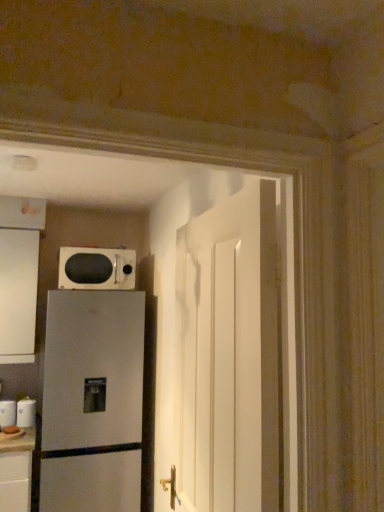
Question: From the image's perspective, is white glossy mug at lower left, which is the 1th appliance from left to right, located beneath white glossy paper towel dispenser at lower left, which is the first appliance in right-to-left order?

Choices:
 (A) no
 (B) yes

Answer: (B)

Question: Is white glossy mug at lower left, which is counted as the second appliance, starting from the right, positioned with its back to white glossy paper towel dispenser at lower left, which appears as the second appliance when viewed from the left?

Choices:
 (A) yes
 (B) no

Answer: (B)

Question: Could you tell me if white glossy mug at lower left, which is counted as the second appliance, starting from the right, is facing white glossy paper towel dispenser at lower left, which appears as the second appliance when viewed from the left?

Choices:
 (A) no
 (B) yes

Answer: (A)

Question: Is white glossy mug at lower left, which is the 1th appliance from left to right, in contact with white glossy paper towel dispenser at lower left, which is the first appliance in right-to-left order?

Choices:
 (A) yes
 (B) no

Answer: (A)

Question: From the image's perspective, would you say white glossy mug at lower left, which is counted as the second appliance, starting from the right, is positioned over white glossy paper towel dispenser at lower left, which appears as the second appliance when viewed from the left?

Choices:
 (A) no
 (B) yes

Answer: (A)

Question: From the image's perspective, is white glossy microwave at upper center positioned above or below white glossy paper towel dispenser at lower left, which is the first appliance in right-to-left order?

Choices:
 (A) below
 (B) above

Answer: (B)

Question: Is white glossy microwave at upper center wider or thinner than white glossy paper towel dispenser at lower left, which is the first appliance in right-to-left order?

Choices:
 (A) wide
 (B) thin

Answer: (A)

Question: From a real-world perspective, is white glossy microwave at upper center above or below white glossy paper towel dispenser at lower left, which appears as the second appliance when viewed from the left?

Choices:
 (A) above
 (B) below

Answer: (A)

Question: Is point (117, 259) closer or farther from the camera than point (26, 402)?

Choices:
 (A) farther
 (B) closer

Answer: (A)

Question: Does point (9, 205) appear closer or farther from the camera than point (66, 485)?

Choices:
 (A) closer
 (B) farther

Answer: (B)

Question: From the image's perspective, is white matte cabinet at left located above or below satin silver refrigerator at lower left?

Choices:
 (A) below
 (B) above

Answer: (B)

Question: Is white matte cabinet at left situated inside satin silver refrigerator at lower left or outside?

Choices:
 (A) inside
 (B) outside

Answer: (B)

Question: Is white matte cabinet at left in front of or behind satin silver refrigerator at lower left in the image?

Choices:
 (A) behind
 (B) front

Answer: (A)

Question: Is point (13, 237) positioned closer to the camera than point (104, 266)?

Choices:
 (A) closer
 (B) farther

Answer: (A)

Question: From a real-world perspective, relative to white glossy microwave at upper center, is white matte cabinet at left vertically above or below?

Choices:
 (A) above
 (B) below

Answer: (B)